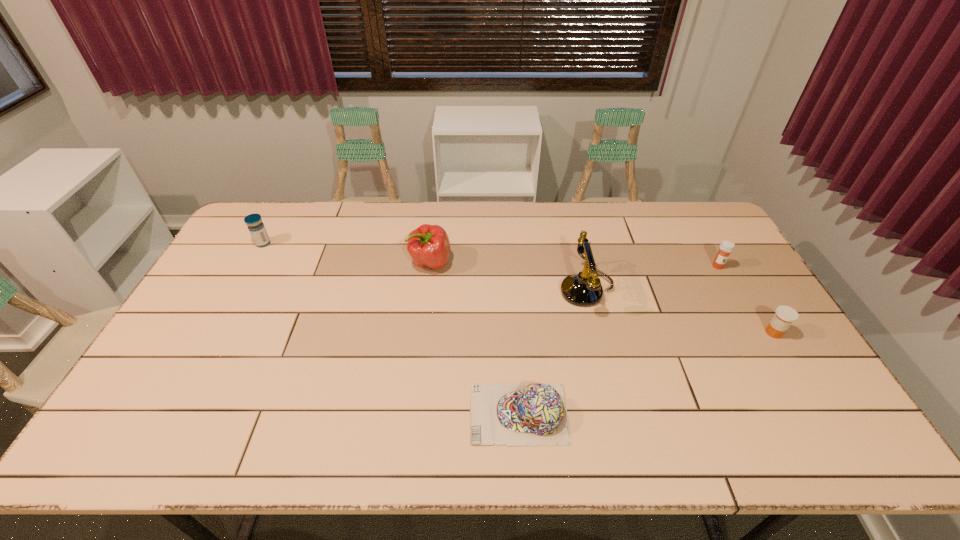
The height and width of the screenshot is (540, 960). Find the location of `the nearest object`. the nearest object is located at coordinates (508, 414).

The height and width of the screenshot is (540, 960). I want to click on cap, so click(x=508, y=414).

The width and height of the screenshot is (960, 540). I want to click on free space located on the dial of the tallest object, so click(487, 290).

I want to click on free space located 0.400m on the dial of the tallest object, so click(x=432, y=290).

Locate an element on the screen. vacant space located 0.390m on the dial of the tallest object is located at coordinates (435, 290).

The width and height of the screenshot is (960, 540). Find the location of `free space located 0.080m on the back of the fifth object from right to left`. free space located 0.080m on the back of the fifth object from right to left is located at coordinates (434, 234).

This screenshot has width=960, height=540. Identify the location of free region located 0.240m on the front of the leftmost object. (232, 299).

I want to click on vacant point located on the label side of the second medicine from left to right, so click(x=748, y=319).

Locate an element on the screen. vacant space positioned 0.260m on the label of the nearest medicine is located at coordinates (673, 333).

At what (x,y) coordinates should I click in order to perform the action: click on free region located on the label of the nearest medicine. Please return your answer as a coordinate pair (x, y). Looking at the image, I should click on coord(690,333).